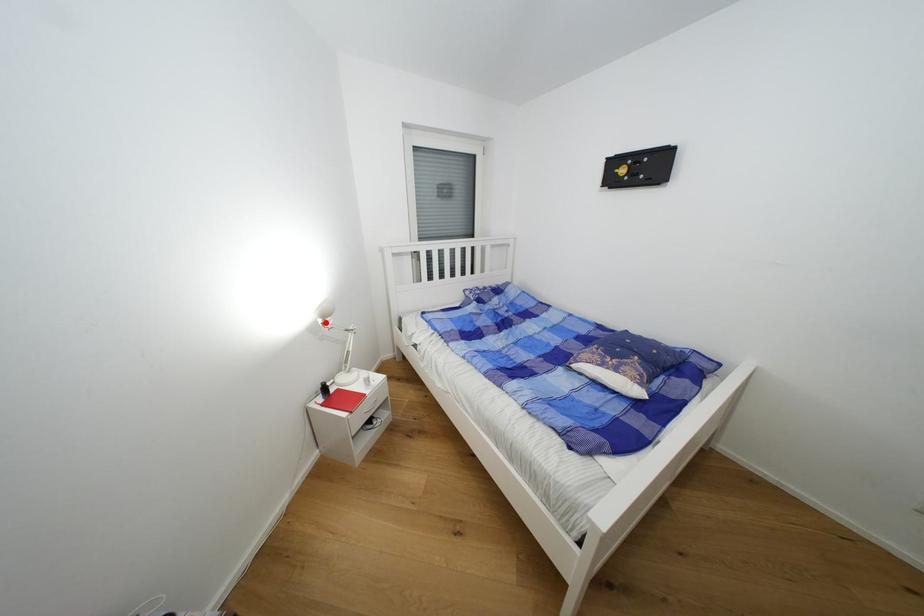
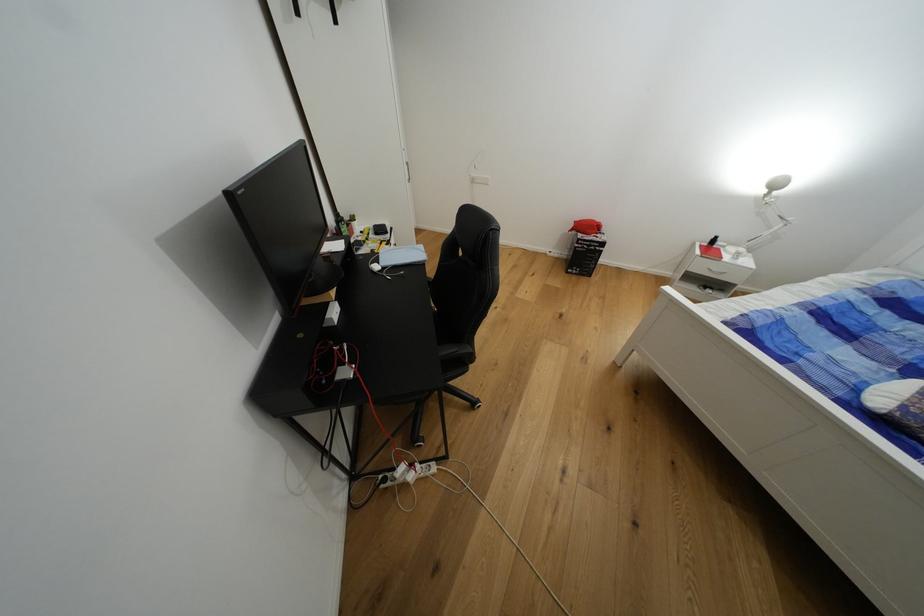
Question: I am providing you with two images of the same scene from different viewpoints. In image1, a red point is highlighted. Considering the same 3D point in image2, which of the following is correct?

Choices:
 (A) It is closer
 (B) It is farther

Answer: (B)